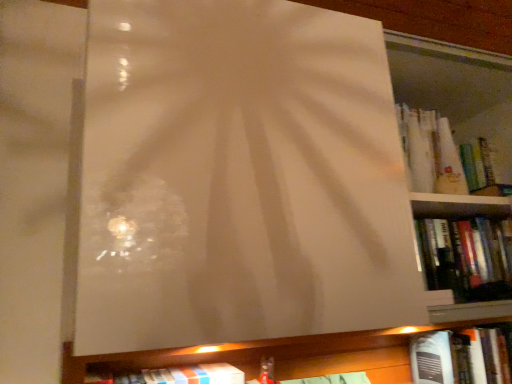
Where is `empty space that is ontop of hardcover book at upper right, which appears as the second book when viewed from the top (from a real-world perspective)`? Image resolution: width=512 pixels, height=384 pixels. empty space that is ontop of hardcover book at upper right, which appears as the second book when viewed from the top (from a real-world perspective) is located at coordinates (465, 221).